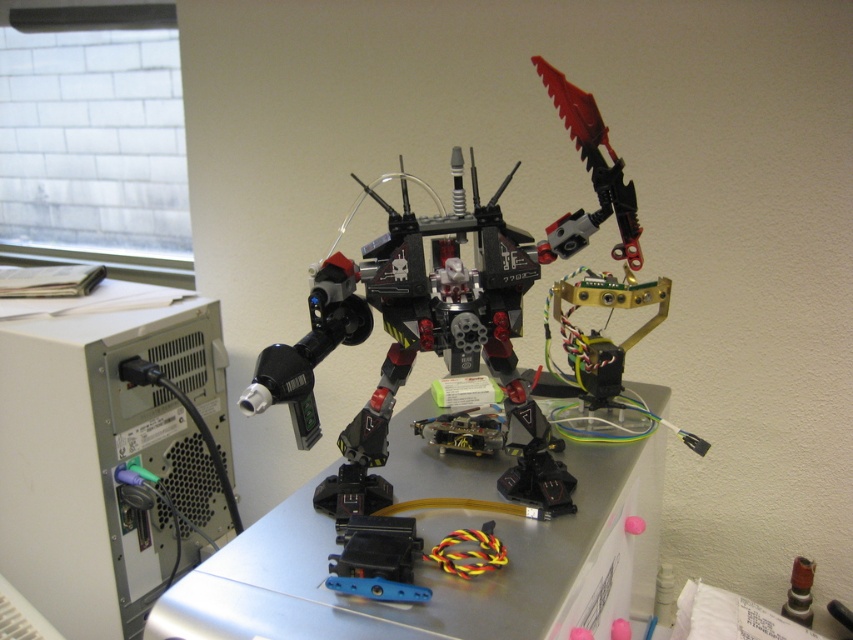
You are organizing a display in an office and need to place the black plastic computer at left and the black plastic robot at center on a shelf. The shelf has a height limit of 18 inches. Which object might not fit due to its height?

The black plastic computer at left is taller than the black plastic robot at center, so it might not fit on the shelf with the 18 inches height limit.

You are organizing a science fair exhibit and need to place both the metallic gray table at center and the black plastic robot at center on a display stand. Given that the display stand has limited space, which object should you prioritize placing first to ensure both fit comfortably?

The metallic gray table at center is bigger than the black plastic robot at center, so you should prioritize placing the metallic gray table at center first to ensure both fit comfortably on the display stand.

You are an engineer working in an office and need to move a tool from the black plastic computer at left to the black plastic robot at center. Which object should you move the tool towards on your right side?

You should move the tool towards the black plastic robot at center because it is located to the right of the black plastic computer at left.